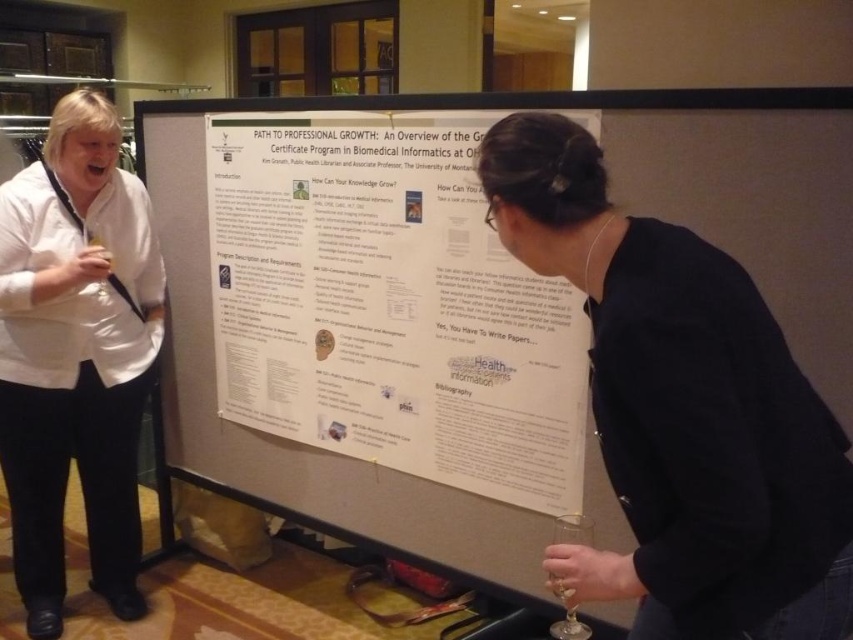
What is the location of the point with coordinates (682, 410) in the image?

The point with coordinates (682, 410) is located on the black matte poster at center.

You are attending a conference and want to read the black matte poster at center. There is a person wearing a white shirt at left blocking your view. Can you move around them to see the poster better?

The black matte poster at center is closer to the viewer than the white shirt at left, so you can move around the person wearing the white shirt at left to get a better view of the poster.